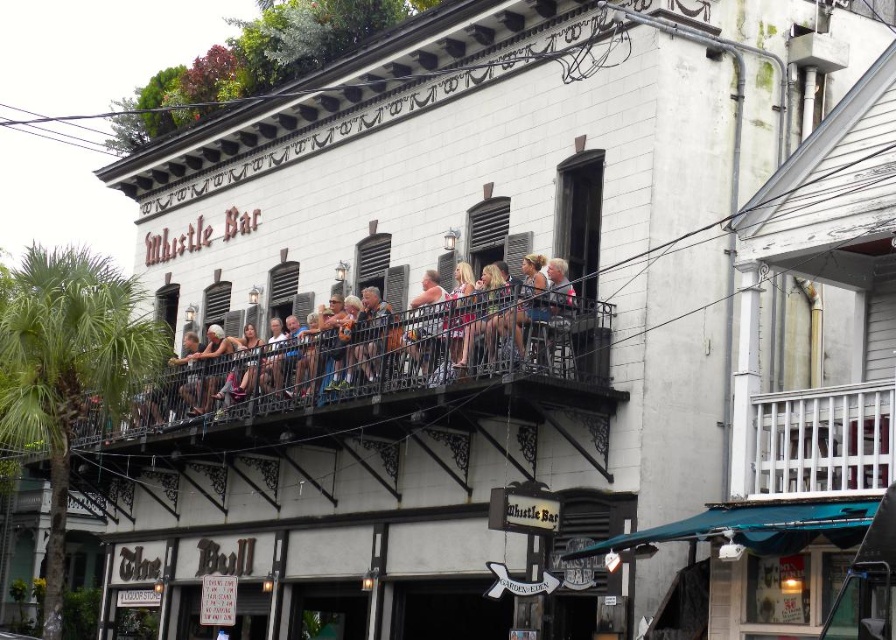
You are a delivery person needing to place a new railing at the balcony of The Bull bar. The existing white wooden railing at upper center is 40.92 meters away from the entrance. Is this distance too long for a standard delivery truck to reach?

The white wooden railing at upper center is 40.92 meters away from the entrance, which is within the standard delivery truck reach range. The delivery truck can reach the white wooden railing at upper center.

You are standing outside The Bull bar and want to see both the white wooden railing at upper center and the matte pink tank top at center. Which one do you see first when looking from the entrance?

The white wooden railing at upper center is in front of the matte pink tank top at center, so you would see the white wooden railing at upper center first when looking from the entrance.

You are a delivery person needing to place a 16 meter long ladder between the matte black balcony railing at center and the white wooden railing at upper center. Can the ladder fit between them?

The distance between the matte black balcony railing at center and the white wooden railing at upper center is 15.94 meters, so the 16 meter ladder is slightly too long to fit between them.